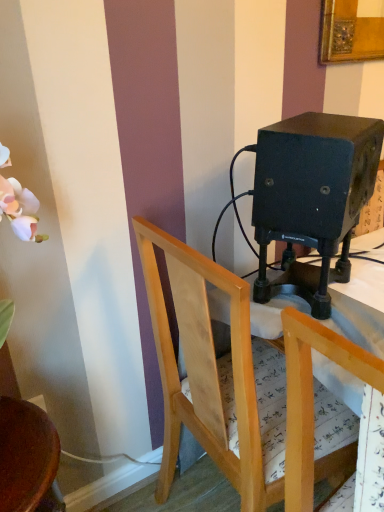
Question: Considering the relative positions of wooden chair at center, which is the second chair from left to right, and light wood chair at center, positioned as the first chair in right-to-left order, in the image provided, is wooden chair at center, which is the second chair from left to right, to the right of light wood chair at center, positioned as the first chair in right-to-left order, from the viewer's perspective?

Choices:
 (A) yes
 (B) no

Answer: (B)

Question: Is wooden chair at center, placed as the second chair when sorted from right to left, wider than light wood chair at center, the third chair from the left?

Choices:
 (A) no
 (B) yes

Answer: (B)

Question: From a real-world perspective, is wooden chair at center, which is the second chair from left to right, beneath light wood chair at center, the third chair from the left?

Choices:
 (A) yes
 (B) no

Answer: (A)

Question: Can you see wooden chair at center, which is the second chair from left to right, touching light wood chair at center, positioned as the first chair in right-to-left order?

Choices:
 (A) no
 (B) yes

Answer: (A)

Question: Is wooden chair at center, which is the second chair from left to right, bigger than light wood chair at center, positioned as the first chair in right-to-left order?

Choices:
 (A) yes
 (B) no

Answer: (A)

Question: From the image's perspective, would you say wooden chair at center, which is the second chair from left to right, is positioned over light wood chair at center, the third chair from the left?

Choices:
 (A) no
 (B) yes

Answer: (B)

Question: Considering the relative positions of wooden chair at lower left, the first chair when ordered from left to right, and wooden chair at center, placed as the second chair when sorted from right to left, in the image provided, is wooden chair at lower left, the first chair when ordered from left to right, to the left of wooden chair at center, placed as the second chair when sorted from right to left, from the viewer's perspective?

Choices:
 (A) yes
 (B) no

Answer: (A)

Question: From the image's perspective, does wooden chair at lower left, which is counted as the 3th chair, starting from the right, appear higher than wooden chair at center, placed as the second chair when sorted from right to left?

Choices:
 (A) yes
 (B) no

Answer: (B)

Question: Is wooden chair at lower left, the first chair when ordered from left to right, to the right of wooden chair at center, placed as the second chair when sorted from right to left, from the viewer's perspective?

Choices:
 (A) yes
 (B) no

Answer: (B)

Question: Is wooden chair at lower left, which is counted as the 3th chair, starting from the right, outside wooden chair at center, placed as the second chair when sorted from right to left?

Choices:
 (A) yes
 (B) no

Answer: (A)

Question: From a real-world perspective, does wooden chair at lower left, which is counted as the 3th chair, starting from the right, stand above wooden chair at center, which is the second chair from left to right?

Choices:
 (A) yes
 (B) no

Answer: (B)

Question: From the image's perspective, is wooden chair at lower left, the first chair when ordered from left to right, below wooden chair at center, placed as the second chair when sorted from right to left?

Choices:
 (A) no
 (B) yes

Answer: (B)

Question: Is light wood chair at center, positioned as the first chair in right-to-left order, at the right side of wooden chair at lower left, the first chair when ordered from left to right?

Choices:
 (A) no
 (B) yes

Answer: (B)